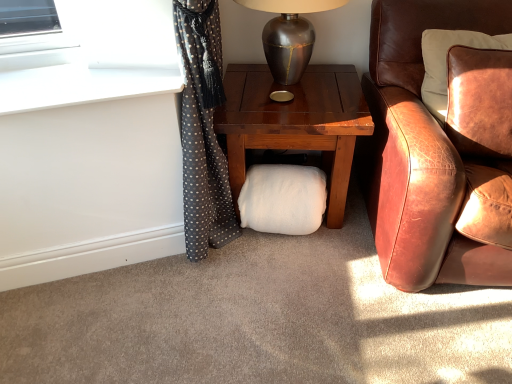
Question: From a real-world perspective, is white fluffy pillow at center physically below white smooth window sill at upper left?

Choices:
 (A) no
 (B) yes

Answer: (B)

Question: Does white fluffy pillow at center have a lesser width compared to white smooth window sill at upper left?

Choices:
 (A) yes
 (B) no

Answer: (A)

Question: Considering the relative sizes of white fluffy pillow at center and white smooth window sill at upper left in the image provided, is white fluffy pillow at center smaller than white smooth window sill at upper left?

Choices:
 (A) yes
 (B) no

Answer: (B)

Question: Considering the relative sizes of white fluffy pillow at center and white smooth window sill at upper left in the image provided, is white fluffy pillow at center shorter than white smooth window sill at upper left?

Choices:
 (A) yes
 (B) no

Answer: (B)

Question: Does white fluffy pillow at center turn towards white smooth window sill at upper left?

Choices:
 (A) yes
 (B) no

Answer: (B)

Question: Is white fluffy pillow at center not close to white smooth window sill at upper left?

Choices:
 (A) yes
 (B) no

Answer: (B)

Question: Is brown leather chair at right to the right of white smooth window sill at upper left from the viewer's perspective?

Choices:
 (A) no
 (B) yes

Answer: (B)

Question: Does brown leather chair at right have a lesser width compared to white smooth window sill at upper left?

Choices:
 (A) yes
 (B) no

Answer: (B)

Question: Are brown leather chair at right and white smooth window sill at upper left far apart?

Choices:
 (A) no
 (B) yes

Answer: (A)

Question: From a real-world perspective, is brown leather chair at right under white smooth window sill at upper left?

Choices:
 (A) yes
 (B) no

Answer: (A)

Question: From the image's perspective, does brown leather chair at right appear higher than white smooth window sill at upper left?

Choices:
 (A) yes
 (B) no

Answer: (B)

Question: Is the depth of brown leather chair at right greater than that of white smooth window sill at upper left?

Choices:
 (A) yes
 (B) no

Answer: (B)

Question: Does metallic silver table lamp at upper center have a larger size compared to white smooth window sill at upper left?

Choices:
 (A) yes
 (B) no

Answer: (A)